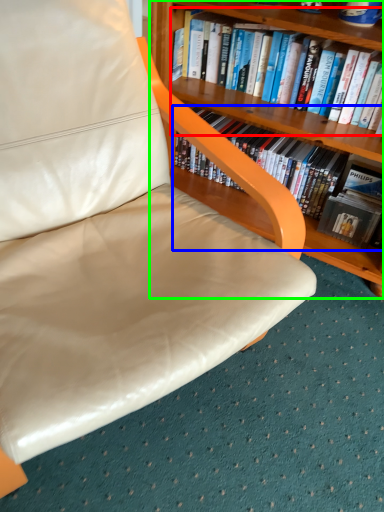
Question: Which object is positioned farthest from book (highlighted by a red box)? Select from book (highlighted by a blue box) and bookcase (highlighted by a green box).

Choices:
 (A) book
 (B) bookcase

Answer: (A)